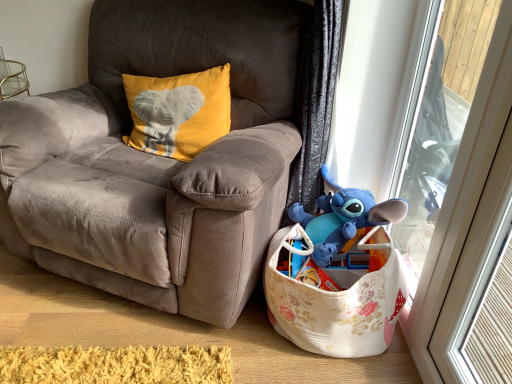
Question: Should I look upward or downward to see yellow soft fabric pillow with elephant design at upper left?

Choices:
 (A) down
 (B) up

Answer: (B)

Question: Considering the relative sizes of blue plush toy at lower right and yellow soft fabric pillow with elephant design at upper left in the image provided, is blue plush toy at lower right smaller than yellow soft fabric pillow with elephant design at upper left?

Choices:
 (A) yes
 (B) no

Answer: (A)

Question: Is blue plush toy at lower right wider than yellow soft fabric pillow with elephant design at upper left?

Choices:
 (A) no
 (B) yes

Answer: (B)

Question: Would you say blue plush toy at lower right is outside yellow soft fabric pillow with elephant design at upper left?

Choices:
 (A) no
 (B) yes

Answer: (B)

Question: Does blue plush toy at lower right appear on the right side of yellow soft fabric pillow with elephant design at upper left?

Choices:
 (A) yes
 (B) no

Answer: (A)

Question: Does blue plush toy at lower right have a lesser height compared to yellow soft fabric pillow with elephant design at upper left?

Choices:
 (A) no
 (B) yes

Answer: (B)

Question: Is blue plush toy at lower right positioned with its back to yellow soft fabric pillow with elephant design at upper left?

Choices:
 (A) yes
 (B) no

Answer: (B)

Question: Can you confirm if suede gray chair at center is positioned to the right of blue plush toy at lower right?

Choices:
 (A) yes
 (B) no

Answer: (B)

Question: Can we say suede gray chair at center lies outside blue plush toy at lower right?

Choices:
 (A) no
 (B) yes

Answer: (B)

Question: Is suede gray chair at center wider than blue plush toy at lower right?

Choices:
 (A) yes
 (B) no

Answer: (A)

Question: Would you say suede gray chair at center contains blue plush toy at lower right?

Choices:
 (A) yes
 (B) no

Answer: (B)

Question: Does suede gray chair at center appear on the left side of blue plush toy at lower right?

Choices:
 (A) no
 (B) yes

Answer: (B)

Question: Does suede gray chair at center touch blue plush toy at lower right?

Choices:
 (A) no
 (B) yes

Answer: (A)

Question: Can you confirm if yellow soft fabric pillow with elephant design at upper left is thinner than blue plush toy at lower right?

Choices:
 (A) yes
 (B) no

Answer: (A)